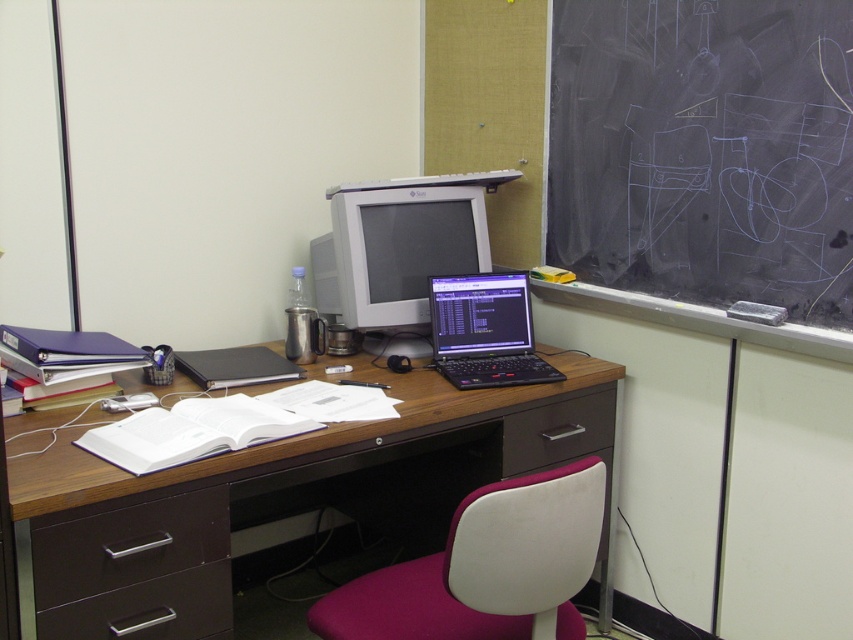
Between black chalkboard at upper right and dark brown wood drawer at lower center, which one is positioned lower?

dark brown wood drawer at lower center is below.

Does point (665, 234) come closer to viewer compared to point (552, 458)?

No, it is not.

Identify the location of black chalkboard at upper right. (705, 150).

You are a GUI agent. You are given a task and a screenshot of the screen. Output one action in this format:
    pyautogui.click(x=<x>, y=<y>)
    Task: Click on the black chalkboard at upper right
    The width and height of the screenshot is (853, 640).
    Given the screenshot: What is the action you would take?
    pyautogui.click(x=705, y=150)

Does black chalkboard at upper right have a greater width compared to matte gray monitor at center?

Indeed, black chalkboard at upper right has a greater width compared to matte gray monitor at center.

The height and width of the screenshot is (640, 853). I want to click on black chalkboard at upper right, so click(x=705, y=150).

At what (x,y) coordinates should I click in order to perform the action: click on black chalkboard at upper right. Please return your answer as a coordinate pair (x, y). The width and height of the screenshot is (853, 640). Looking at the image, I should click on (705, 150).

Where is `black chalkboard at upper right`? Image resolution: width=853 pixels, height=640 pixels. black chalkboard at upper right is located at coordinates (705, 150).

Between matte black drawer at lower left and dark brown wood drawer at lower center, which one has less height?

matte black drawer at lower left

Is matte black drawer at lower left smaller than dark brown wood drawer at lower center?

Indeed, matte black drawer at lower left has a smaller size compared to dark brown wood drawer at lower center.

Which is behind, point (155, 624) or point (613, 410)?

Positioned behind is point (613, 410).

Locate an element on the screen. matte black drawer at lower left is located at coordinates (149, 609).